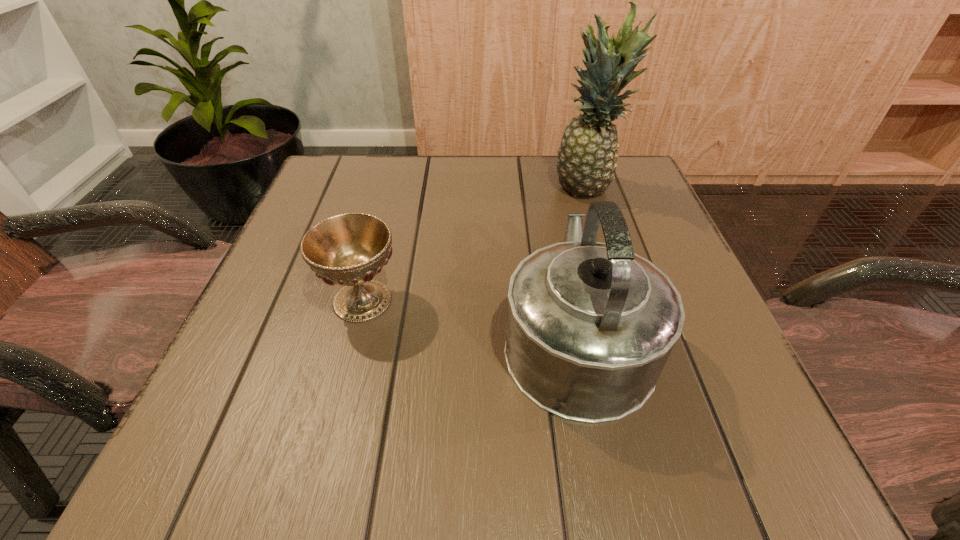
Find the location of `vacant space at the far left corner`. vacant space at the far left corner is located at coordinates (304, 211).

Locate an element on the screen. vacant space at the near left corner is located at coordinates (205, 447).

Locate an element on the screen. free region at the far right corner is located at coordinates coord(627,156).

Image resolution: width=960 pixels, height=540 pixels. Identify the location of free spot between the shortest object and the second tallest object. (469, 318).

The image size is (960, 540). I want to click on unoccupied area between the leftmost object and the kettle, so click(x=469, y=318).

Identify the location of vacant area between the shortest object and the kettle. (469, 318).

Where is `vacant area that lies between the leftmost object and the second tallest object`? The height and width of the screenshot is (540, 960). vacant area that lies between the leftmost object and the second tallest object is located at coordinates (469, 318).

You are a GUI agent. You are given a task and a screenshot of the screen. Output one action in this format:
    pyautogui.click(x=<x>, y=<y>)
    Task: Click on the vacant area that lies between the tallest object and the chalice
    
    Given the screenshot: What is the action you would take?
    (x=474, y=245)

I want to click on vacant space that's between the pineapple and the leftmost object, so click(x=474, y=245).

Identify the location of object that is the second closest to the kettle. (587, 157).